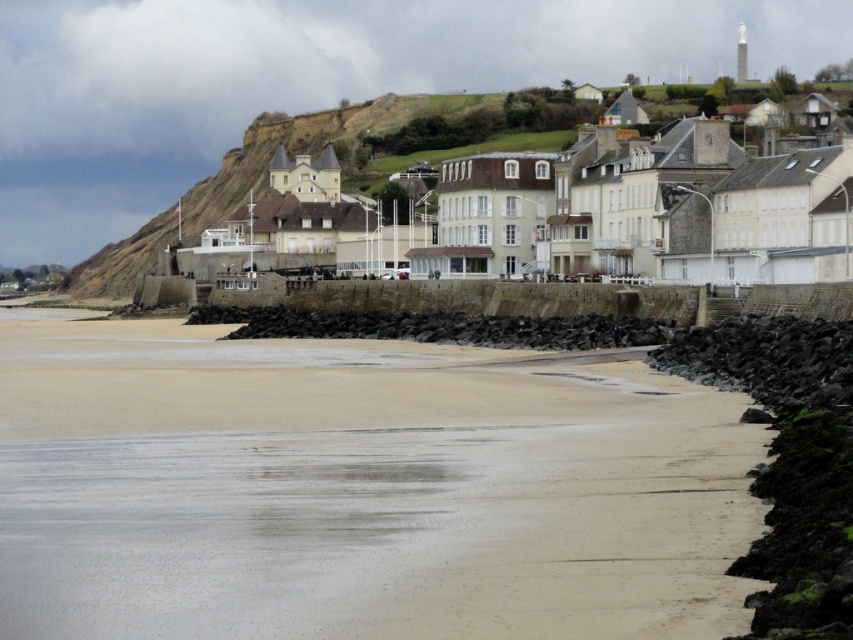
Question: Does sandy beach at lower center appear under white stone buildings at center?

Choices:
 (A) yes
 (B) no

Answer: (A)

Question: Can you confirm if sandy beach at lower center is smaller than white stone buildings at center?

Choices:
 (A) no
 (B) yes

Answer: (B)

Question: Which object is farther from the camera taking this photo?

Choices:
 (A) white stone buildings at center
 (B) sandy beach at lower center

Answer: (A)

Question: Is sandy beach at lower center above white stone buildings at center?

Choices:
 (A) yes
 (B) no

Answer: (B)

Question: Among these objects, which one is farthest from the camera?

Choices:
 (A) white stone buildings at center
 (B) sandy beach at lower center

Answer: (A)